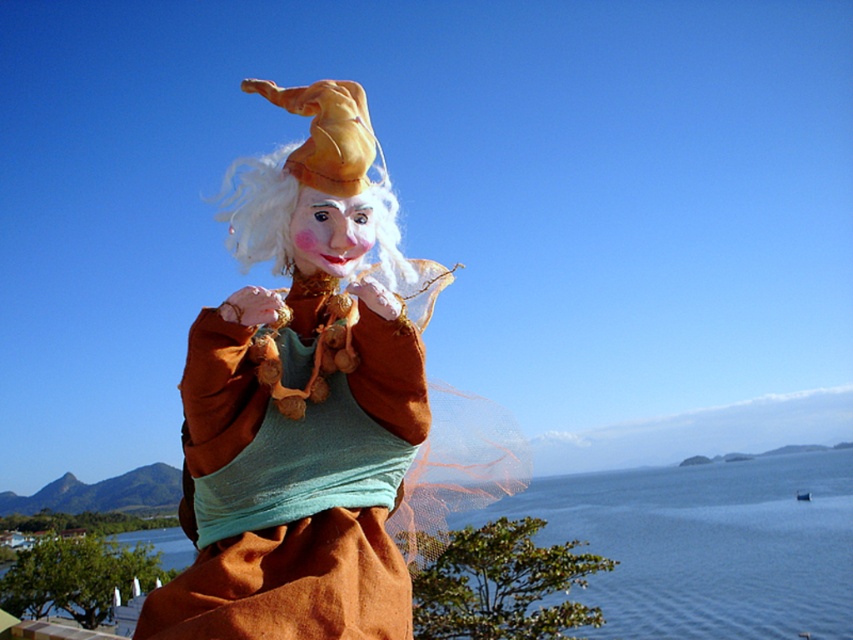
Can you confirm if matte brown doll at center is positioned to the right of white fabric wig at center?

Yes, matte brown doll at center is to the right of white fabric wig at center.

Is point (346, 209) positioned after point (227, 221)?

No, it is not.

Between point (233, 588) and point (258, 180), which one is positioned in front?

Positioned in front is point (233, 588).

Image resolution: width=853 pixels, height=640 pixels. I want to click on matte brown doll at center, so (302, 403).

Between blue water at center and white fabric wig at center, which one has less height?

With less height is white fabric wig at center.

Is point (792, 532) closer to camera compared to point (399, 276)?

No, (792, 532) is behind (399, 276).

This screenshot has width=853, height=640. Describe the element at coordinates (706, 545) in the screenshot. I see `blue water at center` at that location.

Where is `blue water at center`? blue water at center is located at coordinates (706, 545).

Is the position of matte brown doll at center less distant than that of blue water at center?

Yes.

Is matte brown doll at center below blue water at center?

No, matte brown doll at center is not below blue water at center.

Does point (267, 545) lie behind point (825, 467)?

No, (267, 545) is closer to viewer.

What are the coordinates of `matte brown doll at center` in the screenshot? It's located at (302, 403).